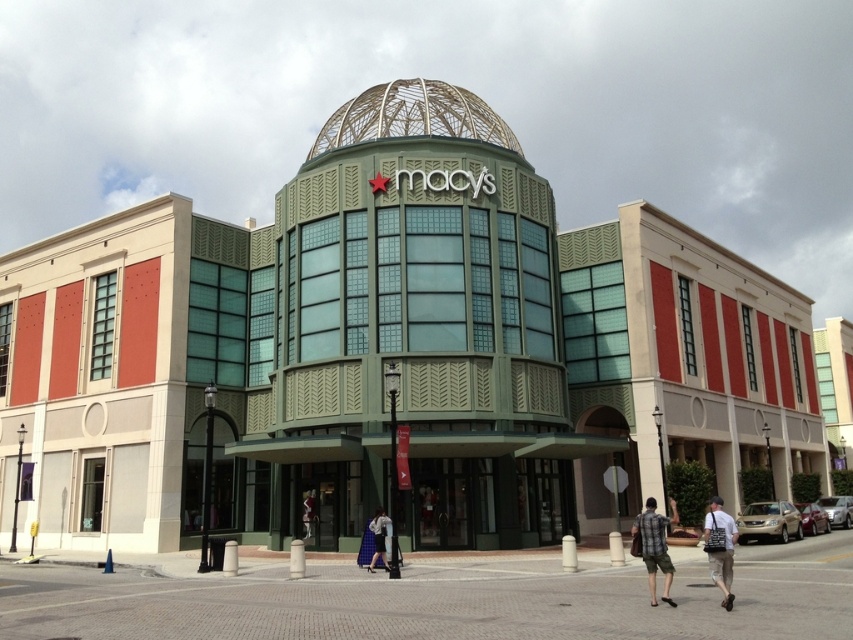
Is metallic wireframe dome at center bigger than khaki cotton shorts at lower right?

Yes, metallic wireframe dome at center is bigger than khaki cotton shorts at lower right.

Can you confirm if metallic wireframe dome at center is positioned to the left of khaki cotton shorts at lower right?

Yes, metallic wireframe dome at center is to the left of khaki cotton shorts at lower right.

Does point (338, 124) come farther from viewer compared to point (730, 522)?

Yes, it is behind point (730, 522).

Image resolution: width=853 pixels, height=640 pixels. In order to click on metallic wireframe dome at center in this screenshot , I will do `click(412, 116)`.

Does plaid fabric shirt at lower right have a greater width compared to denim pants at lower center?

Indeed, plaid fabric shirt at lower right has a greater width compared to denim pants at lower center.

Is plaid fabric shirt at lower right taller than denim pants at lower center?

Yes.

Locate an element on the screen. The height and width of the screenshot is (640, 853). plaid fabric shirt at lower right is located at coordinates (654, 545).

Between green glass dome at center and khaki cotton shorts at lower right, which one is positioned lower?

khaki cotton shorts at lower right is below.

How far apart are green glass dome at center and khaki cotton shorts at lower right?

They are 36.01 meters apart.

Between point (231, 515) and point (709, 504), which one is positioned in front?

Point (231, 515) is in front.

Image resolution: width=853 pixels, height=640 pixels. Find the location of `green glass dome at center`. green glass dome at center is located at coordinates (390, 352).